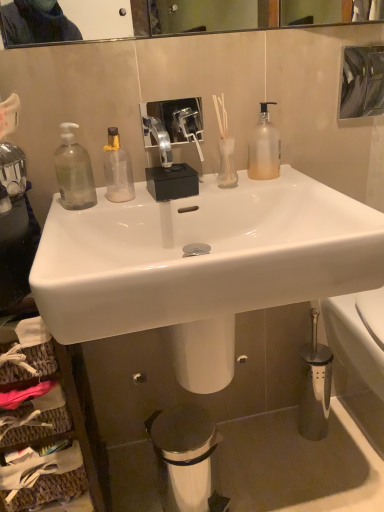
Question: Considering the relative positions of clear glass bottle at center, which is the 2th bottle from right to left, and translucent glass vase at center in the image provided, is clear glass bottle at center, which is the 2th bottle from right to left, to the left or to the right of translucent glass vase at center?

Choices:
 (A) right
 (B) left

Answer: (B)

Question: Considering the positions of clear glass bottle at center, which is the 2th bottle from right to left, and translucent glass vase at center in the image, is clear glass bottle at center, which is the 2th bottle from right to left, bigger or smaller than translucent glass vase at center?

Choices:
 (A) small
 (B) big

Answer: (B)

Question: Which object is positioned closest to the woven wood cabinet at lower left?

Choices:
 (A) clear glass bottle at center, the second bottle positioned from the left
 (B) clear glass vase at center
 (C) transparent plastic bottle at left, which is the 3th bottle in right-to-left order
 (D) white glossy sink at center
 (E) frosted glass pump bottle at upper right, which is counted as the 3th bottle, starting from the left

Answer: (D)

Question: Estimate the real-world distances between objects in this image. Which object is farther from the white glossy toilet at lower right?

Choices:
 (A) frosted glass pump bottle at upper right, the first bottle positioned from the right
 (B) metallic reflective mirror at upper right
 (C) transparent plastic bottle at left, which is the 3th bottle in right-to-left order
 (D) woven wood cabinet at lower left
 (E) clear glass bottle at center, the second bottle positioned from the left

Answer: (B)